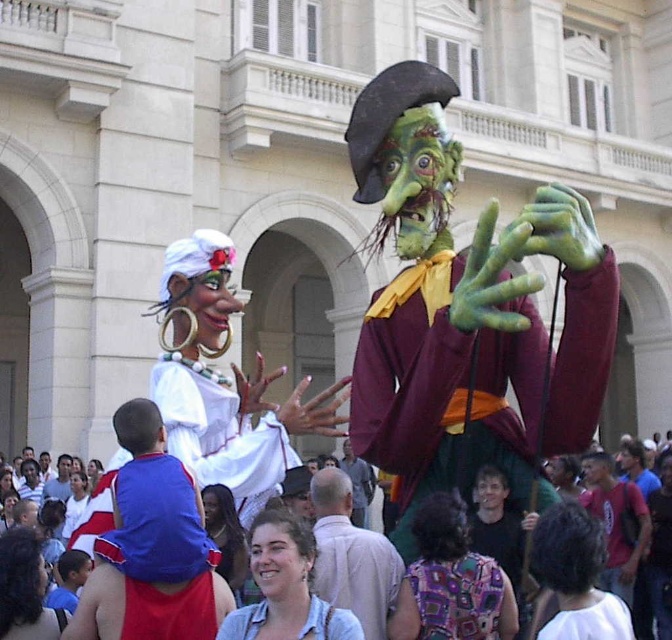
You are a photographer standing at the edge of the crowd. You want to capture both the knitted fabric blouse at center and the other central figure in the same frame. Given that your camera has a maximum zoom range of 15 meters, can you fit both figures into your shot?

The two central figures are 20.03 meters apart, which exceeds the camera maximum zoom range of 15 meters. Therefore, you cannot fit both the knitted fabric blouse at center and the other central figure into the same frame.

You are a photographer trying to capture both the knitted fabric blouse at center and the smooth gray shirt at center in a single frame. Since you want to highlight the height difference between them, which one should you position closer to the bottom of the photo?

To emphasize the height difference between the knitted fabric blouse at center and the smooth gray shirt at center, you should position the knitted fabric blouse at center closer to the bottom of the photo since it is shorter than the smooth gray shirt at center.

You are a photographer trying to capture both the knitted fabric blouse at center and the matte white shirt at center in a single frame. Given that your camera has a fixed focus that can only accommodate the wider of the two objects, which one should you focus on to ensure both are in the frame?

The knitted fabric blouse at center is narrower than the matte white shirt at center. Therefore, focusing on the matte white shirt at center, which is wider, will ensure both objects fit within the camera frame.